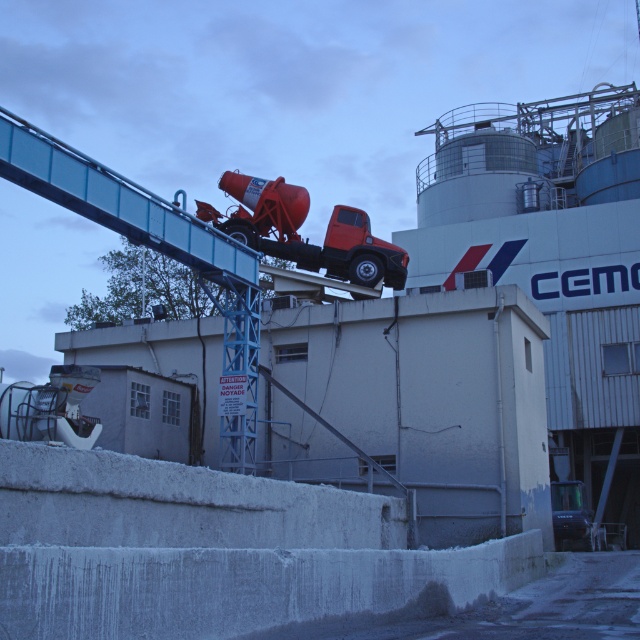
You are an engineer inspecting the cement factory. You need to determine if the matte orange concrete mixer at upper center can be moved through a gate that the metallic gray truck at lower right previously passed through. Can it fit based on their widths?

The matte orange concrete mixer at upper center is wider than the metallic gray truck at lower right. Since the truck passed through the gate, the mixer may not fit if its width exceeds the gate opening.

You are a delivery driver who needs to back up your truck to the loading dock. You see the matte orange concrete mixer at upper center and the metallic gray truck at lower right. Which vehicle should you avoid hitting while backing up?

You should avoid hitting the matte orange concrete mixer at upper center because it is in front of the metallic gray truck at lower right, meaning it is closer to your truck and in your path.